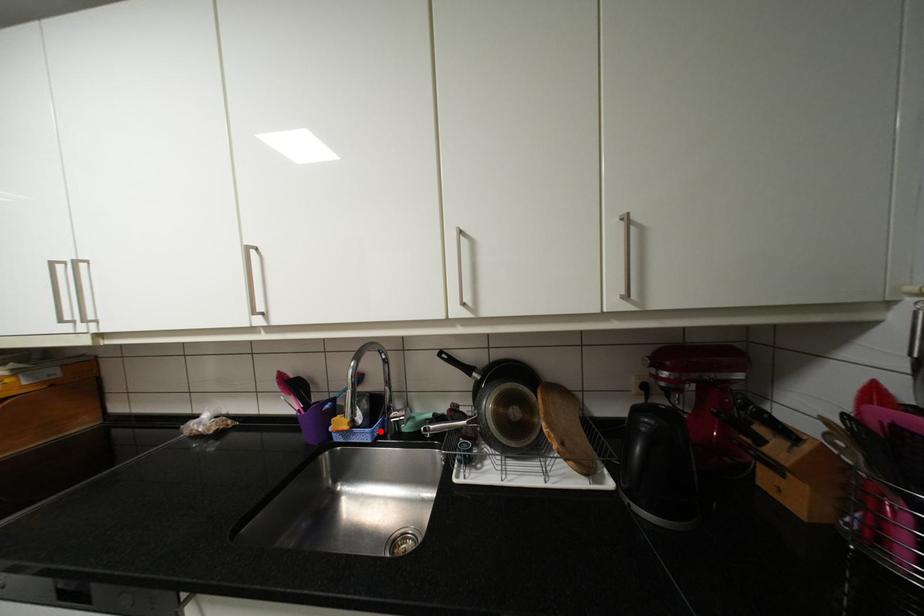
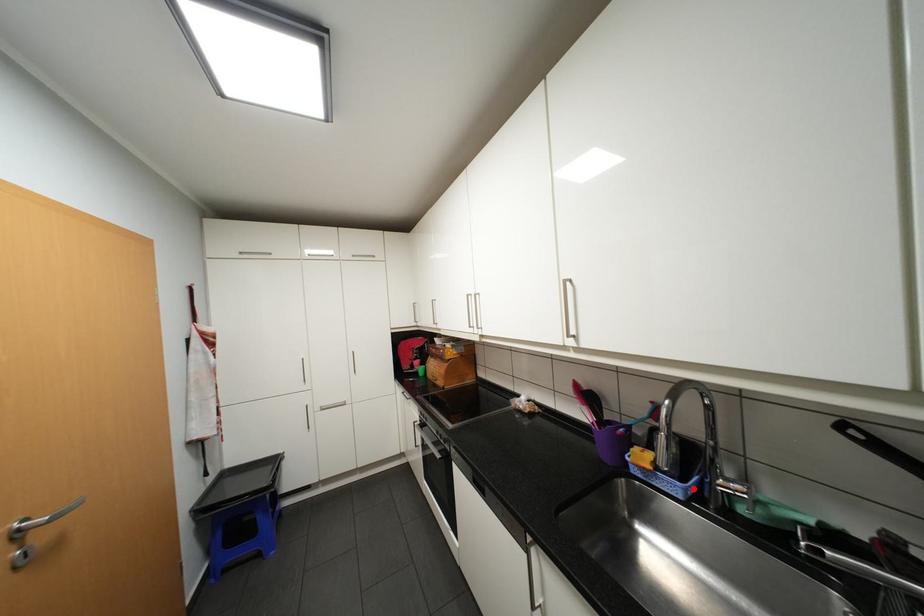
I am providing you with two images of the same scene from different viewpoints. A red point is marked on the first image and another point is marked on the second image. Is the red point in image1 aligned with the point shown in image2?

Yes